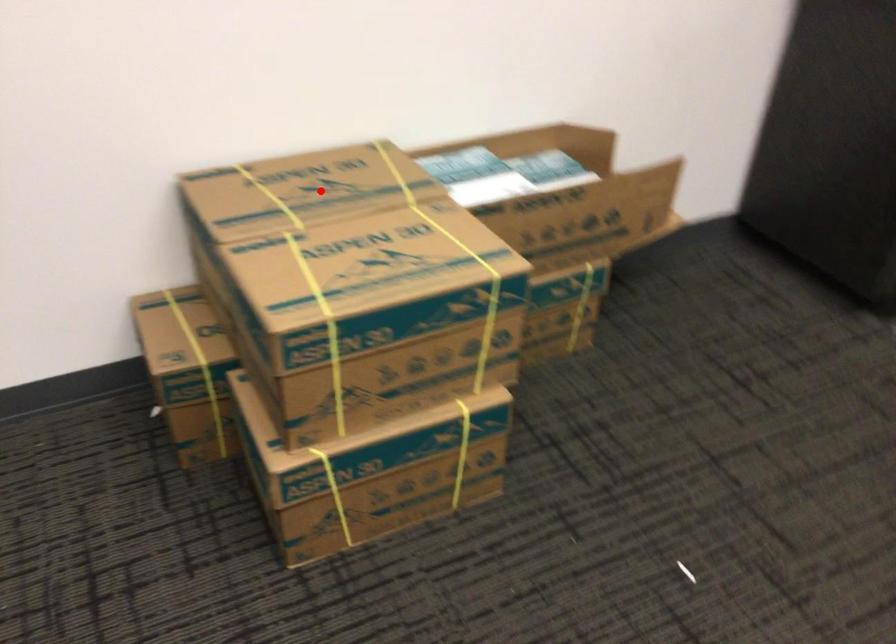
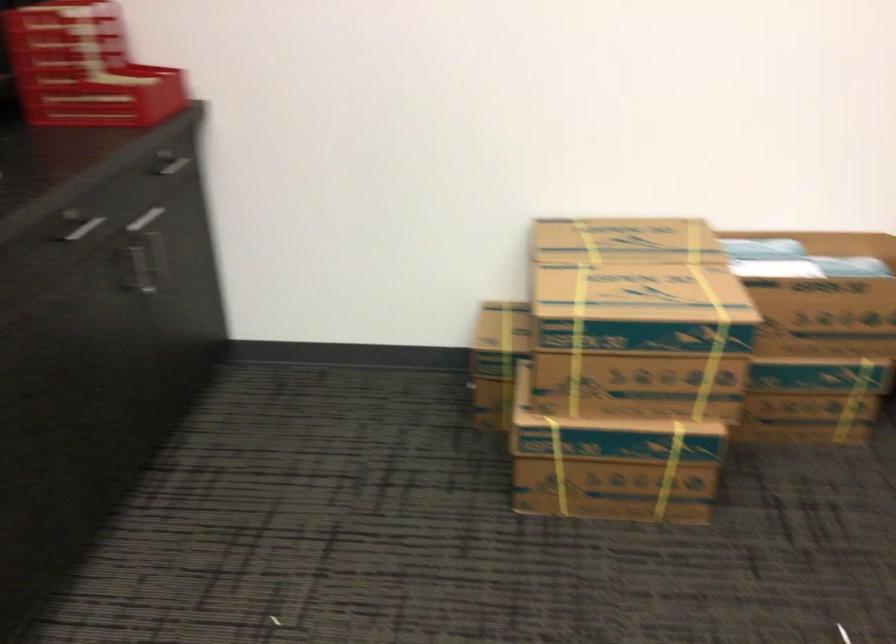
Question: I am providing you with two images of the same scene from different viewpoints. Image1 has a red point marked. In image2, the corresponding 3D location appears at what relative position? Reply with the corresponding letter.

Choices:
 (A) Closer
 (B) Farther

Answer: (B)